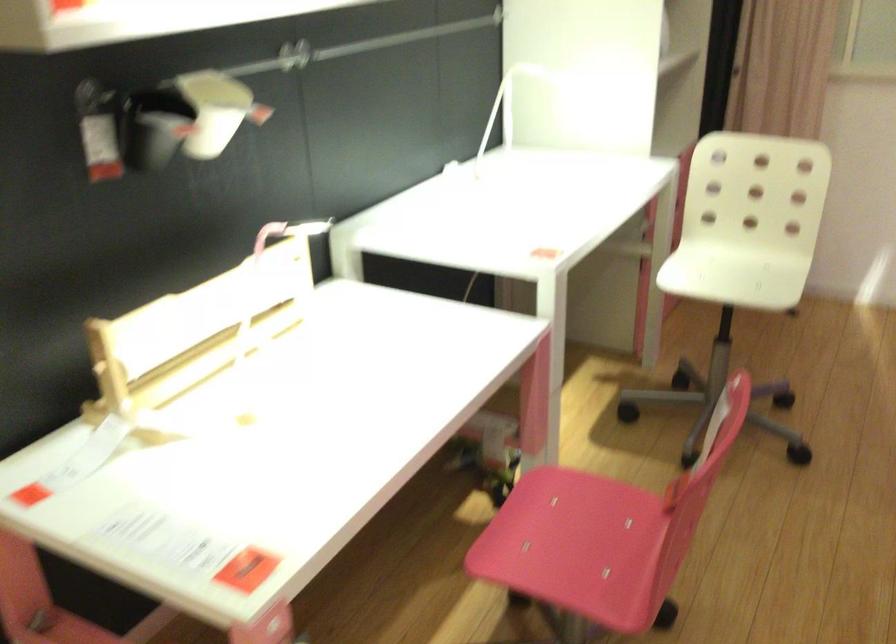
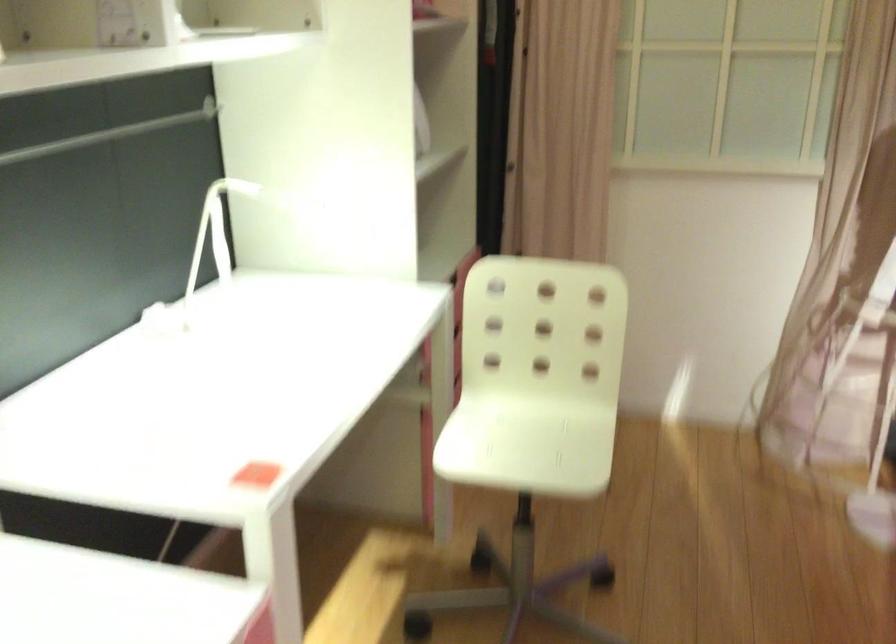
Locate, in the second image, the point that corresponds to (711,269) in the first image.

(495, 431)